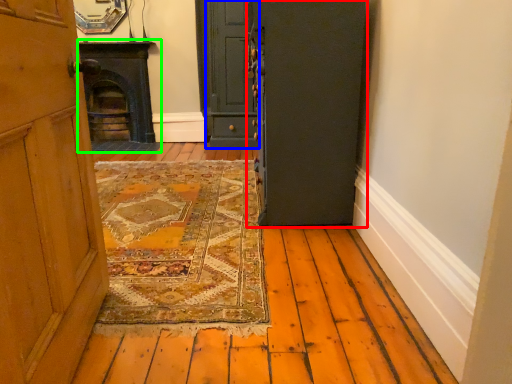
Question: Estimate the real-world distances between objects in this image. Which object is farther from door (highlighted by a red box), door (highlighted by a blue box) or fireplace (highlighted by a green box)?

Choices:
 (A) door
 (B) fireplace

Answer: (B)